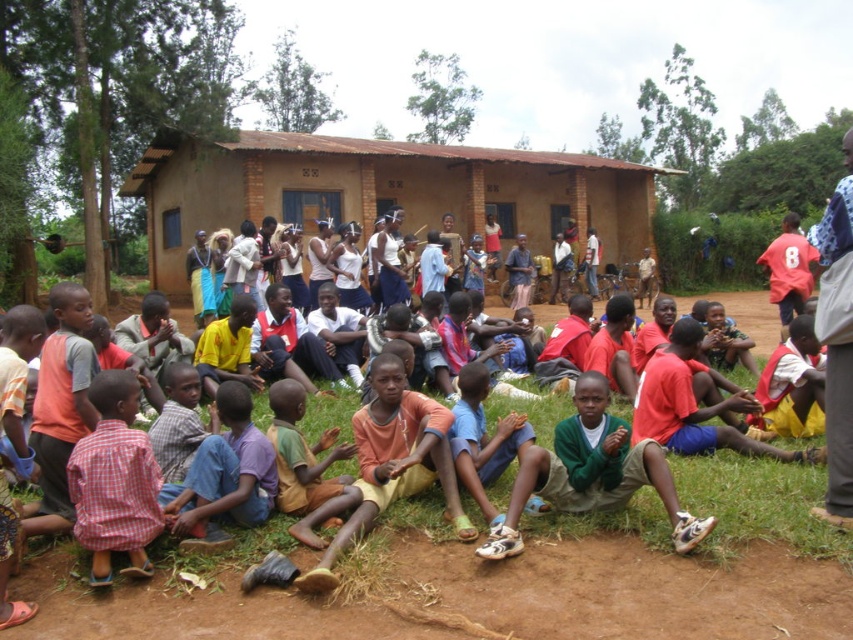
Question: Which of the following is the farthest from the observer?

Choices:
 (A) yellow cotton shirt at center
 (B) brown clay hut at center

Answer: (B)

Question: Is brown clay hut at center below yellow cotton shirt at center?

Choices:
 (A) yes
 (B) no

Answer: (B)

Question: Which object is the closest to the yellow cotton shirt at center?

Choices:
 (A) brown clay hut at center
 (B) light blue fabric pants at lower center

Answer: (B)

Question: Which object is the farthest from the brown clay hut at center?

Choices:
 (A) yellow cotton shirt at center
 (B) light blue fabric pants at lower center

Answer: (B)

Question: Can you confirm if yellow cotton shirt at center is thinner than light blue fabric pants at lower center?

Choices:
 (A) no
 (B) yes

Answer: (A)

Question: Does yellow cotton shirt at center appear on the left side of light blue fabric pants at lower center?

Choices:
 (A) no
 (B) yes

Answer: (B)